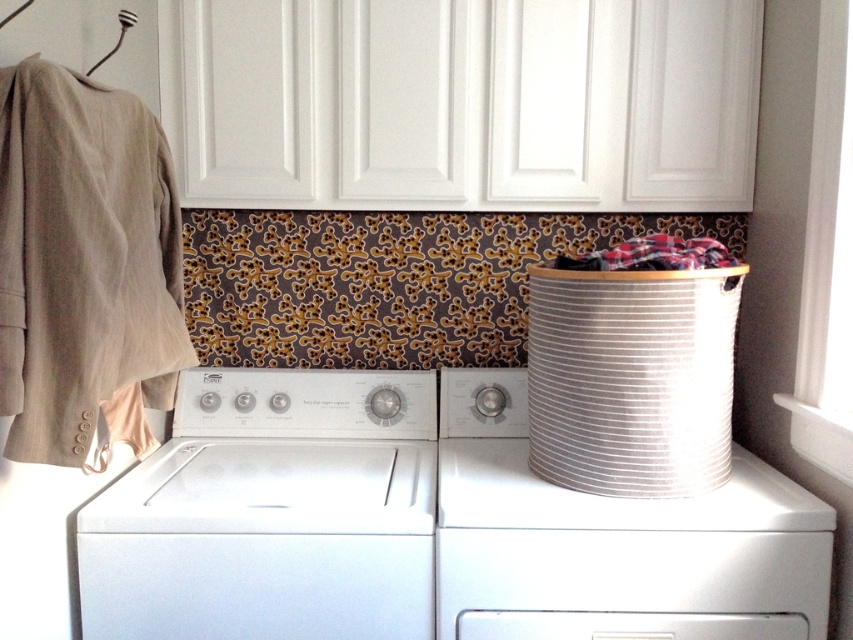
Question: Which object is closer to the camera taking this photo?

Choices:
 (A) metallic fork at upper left
 (B) plaid fabric at center
 (C) white plastic washing machine at center

Answer: (C)

Question: Does white plastic washing machine at right appear on the right side of plaid fabric at center?

Choices:
 (A) no
 (B) yes

Answer: (A)

Question: Which point is closer to the camera taking this photo?

Choices:
 (A) (656, 268)
 (B) (91, 369)
 (C) (277, 608)
 (D) (122, 22)

Answer: (B)

Question: Does beige wool coat at left appear under white striped fabric laundry basket at right?

Choices:
 (A) yes
 (B) no

Answer: (B)

Question: Which point is closer to the camera?

Choices:
 (A) metallic fork at upper left
 (B) white plastic washing machine at center

Answer: (B)

Question: Is white plastic washing machine at right further to camera compared to metallic fork at upper left?

Choices:
 (A) yes
 (B) no

Answer: (B)